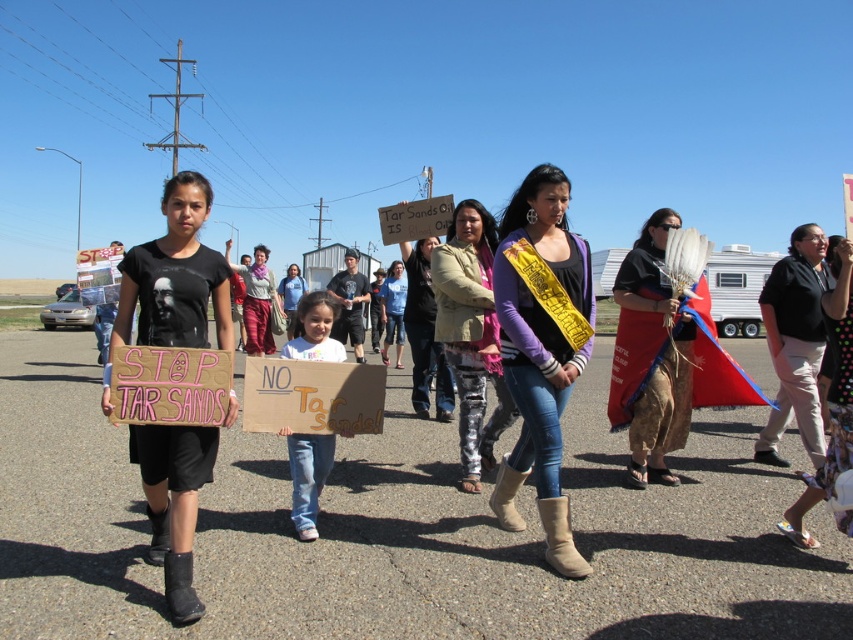
Which is below, matte purple sweater at center or camouflage pants at center?

matte purple sweater at center is lower down.

Can you confirm if matte purple sweater at center is positioned to the right of camouflage pants at center?

Yes, matte purple sweater at center is to the right of camouflage pants at center.

Which is in front, point (508, 388) or point (502, 426)?

Point (508, 388)

The width and height of the screenshot is (853, 640). I want to click on matte purple sweater at center, so click(x=541, y=348).

Is matte purple sweater at center thinner than denim jeans at center?

No.

Consider the image. Is matte purple sweater at center further to the viewer compared to denim jeans at center?

No.

Which is in front, point (540, 483) or point (321, 474)?

Positioned in front is point (540, 483).

In order to click on matte purple sweater at center in this screenshot , I will do `click(541, 348)`.

Between matte purple sweater at center and blue fabric headdress at right, which one appears on the left side from the viewer's perspective?

matte purple sweater at center is more to the left.

Consider the image. Is matte purple sweater at center closer to camera compared to blue fabric headdress at right?

Yes.

What do you see at coordinates (541, 348) in the screenshot? I see `matte purple sweater at center` at bounding box center [541, 348].

The image size is (853, 640). I want to click on matte purple sweater at center, so click(541, 348).